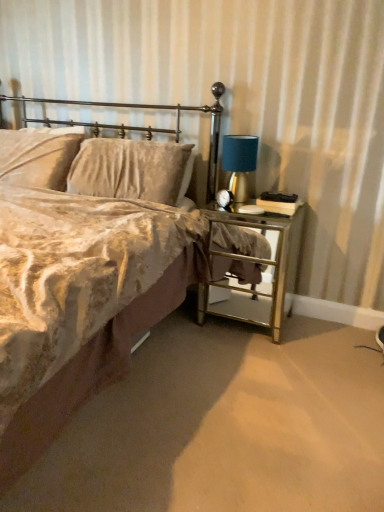
Question: Does point pos(110,244) appear closer or farther from the camera than point pos(223,156)?

Choices:
 (A) farther
 (B) closer

Answer: (B)

Question: In terms of height, does velvet beige bed at center look taller or shorter compared to blue fabric lampshade at right?

Choices:
 (A) tall
 (B) short

Answer: (A)

Question: Based on their relative distances, which object is nearer to the velvet beige pillow at upper left, the 2th pillow when ordered from right to left?

Choices:
 (A) metallic gold headboard at upper left
 (B) velvet beige pillow at upper left, which is counted as the second pillow, starting from the left
 (C) blue fabric lampshade at right
 (D) gold mirrored nightstand at right
 (E) velvet beige bed at center

Answer: (B)

Question: Estimate the real-world distances between objects in this image. Which object is closer to the metallic gold headboard at upper left?

Choices:
 (A) velvet beige bed at center
 (B) gold mirrored nightstand at right
 (C) blue fabric lampshade at right
 (D) velvet beige pillow at upper left, the 2th pillow when ordered from right to left
 (E) velvet beige pillow at upper left, the 1th pillow in the right-to-left sequence

Answer: (E)